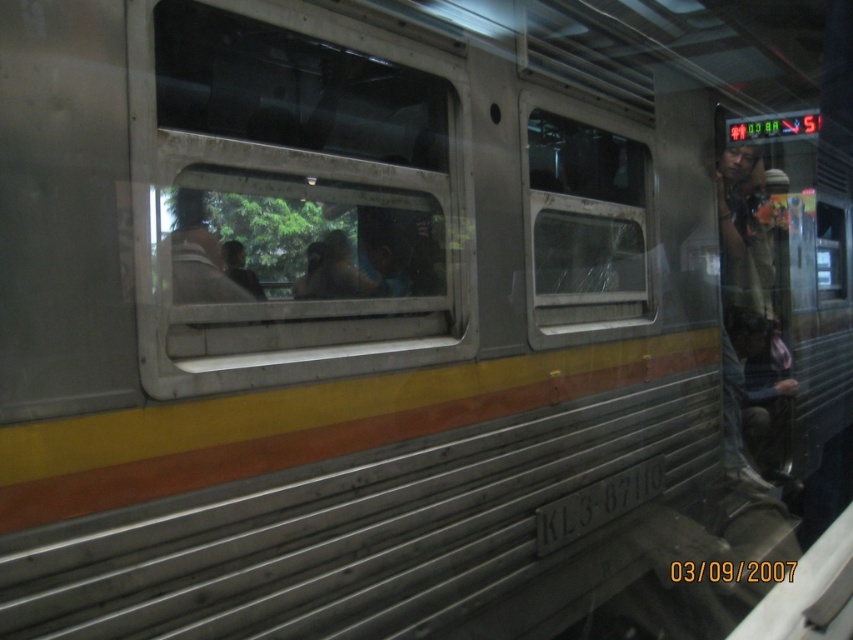
Based on the photo, you are a delivery robot standing near the train KL3 87110. You need to deliver a package to the clear glass window at center. The maximum distance you can reach is 1.5 meters. Can you reach the window?

The clear glass window at center is 1.67 meters away from camera, so the robot cannot reach it since it exceeds the maximum distance of 1.5 meters.

You are standing on a platform and looking at the train KL387110. There are two points marked on the train, one at coordinate point [639,180] and another at point [206,236]. Which point is closer to you?

Point [206,236] is closer to you because it is nearer than point [639,180].

You are a passenger on the train and want to see the view outside through the transparent glass window at center. However, there is a matte brown jacket at center blocking your view. Which object should you move to the left to get an unobstructed view?

You should move the matte brown jacket at center to the left so that it is no longer blocking the transparent glass window at center, allowing you to see through the window.